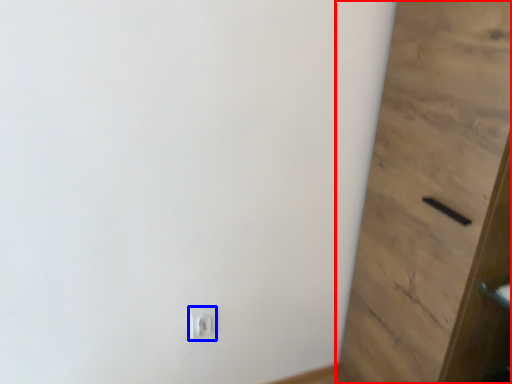
Question: Which of the following is the farthest to the observer, door (highlighted by a red box) or light switch (highlighted by a blue box)?

Choices:
 (A) door
 (B) light switch

Answer: (B)